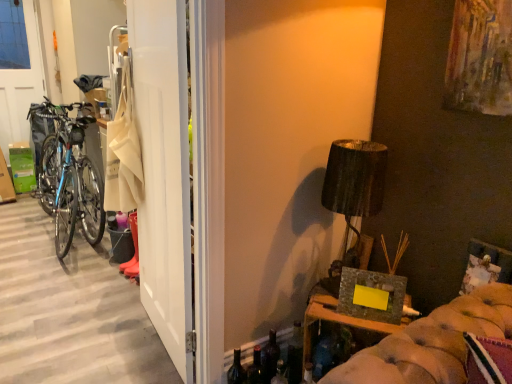
Question: Is translucent glass bottle at lower center, acting as the first bottle starting from the left, closer to the viewer compared to white matte door at left?

Choices:
 (A) no
 (B) yes

Answer: (A)

Question: Is translucent glass bottle at lower center, the 3th bottle from the right, positioned behind white matte door at left?

Choices:
 (A) no
 (B) yes

Answer: (B)

Question: Is translucent glass bottle at lower center, acting as the first bottle starting from the left, touching white matte door at left?

Choices:
 (A) yes
 (B) no

Answer: (B)

Question: Is translucent glass bottle at lower center, the 3th bottle from the right, shorter than white matte door at left?

Choices:
 (A) yes
 (B) no

Answer: (A)

Question: Does translucent glass bottle at lower center, acting as the first bottle starting from the left, have a larger size compared to white matte door at left?

Choices:
 (A) no
 (B) yes

Answer: (A)

Question: From the image's perspective, is transparent plastic screen door at left located above or below matte black lampshade at upper right?

Choices:
 (A) above
 (B) below

Answer: (A)

Question: From a real-world perspective, is transparent plastic screen door at left physically located above or below matte black lampshade at upper right?

Choices:
 (A) below
 (B) above

Answer: (B)

Question: Considering the positions of point (35, 74) and point (351, 248), is point (35, 74) closer or farther from the camera than point (351, 248)?

Choices:
 (A) closer
 (B) farther

Answer: (B)

Question: Based on their sizes in the image, would you say transparent plastic screen door at left is bigger or smaller than matte black lampshade at upper right?

Choices:
 (A) big
 (B) small

Answer: (A)

Question: From a real-world perspective, is transparent plastic screen door at left physically located above or below white matte door at left?

Choices:
 (A) above
 (B) below

Answer: (A)

Question: From the image's perspective, is transparent plastic screen door at left positioned above or below white matte door at left?

Choices:
 (A) below
 (B) above

Answer: (B)

Question: Is transparent plastic screen door at left spatially inside white matte door at left, or outside of it?

Choices:
 (A) outside
 (B) inside

Answer: (A)

Question: Visually, is transparent plastic screen door at left positioned to the left or to the right of white matte door at left?

Choices:
 (A) left
 (B) right

Answer: (A)

Question: From a real-world perspective, is stone-like textured frame at lower right physically located above or below white matte door at left?

Choices:
 (A) below
 (B) above

Answer: (A)

Question: From the image's perspective, is stone-like textured frame at lower right above or below white matte door at left?

Choices:
 (A) below
 (B) above

Answer: (A)